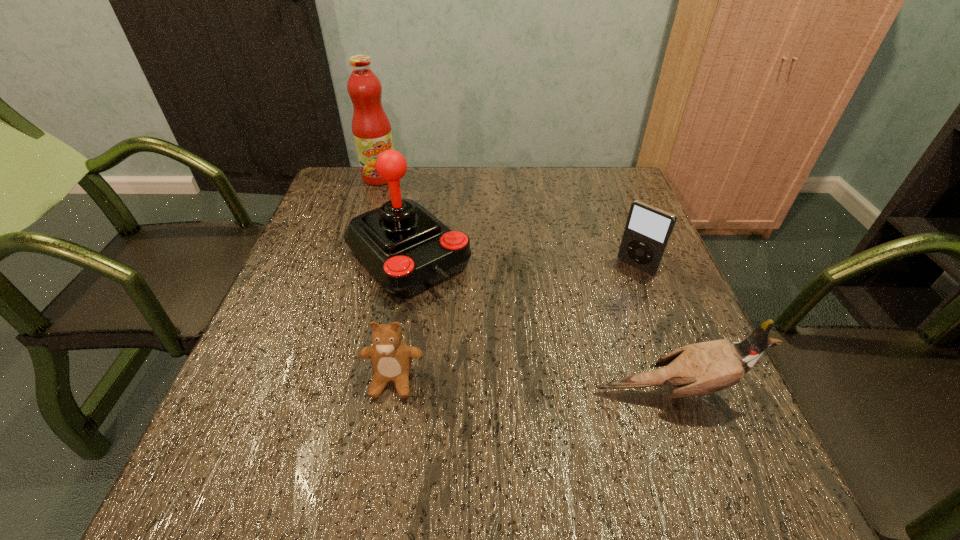
Where is `vacant space positioned on the front label of the fruit juice`? Image resolution: width=960 pixels, height=540 pixels. vacant space positioned on the front label of the fruit juice is located at coordinates (397, 208).

The image size is (960, 540). I want to click on free spot located on the front label of the fruit juice, so click(x=425, y=259).

The width and height of the screenshot is (960, 540). In order to click on blank space located on the front label of the fruit juice in this screenshot , I will do `click(418, 245)`.

The height and width of the screenshot is (540, 960). What are the coordinates of `free region located 0.330m on the base of the second tallest object` in the screenshot? It's located at (546, 394).

Locate an element on the screen. This screenshot has width=960, height=540. free space located 0.190m on the base of the second tallest object is located at coordinates (497, 345).

Find the location of a particular element. The width and height of the screenshot is (960, 540). free spot located 0.220m on the base of the second tallest object is located at coordinates (507, 355).

At what (x,y) coordinates should I click in order to perform the action: click on object at the far edge. Please return your answer as a coordinate pair (x, y). The image size is (960, 540). Looking at the image, I should click on (371, 128).

Find the location of a particular element. This screenshot has height=540, width=960. teddy bear that is positioned at the near edge is located at coordinates (391, 358).

Identify the location of bird at the near edge. (697, 369).

Identify the location of fruit juice at the left edge. (371, 128).